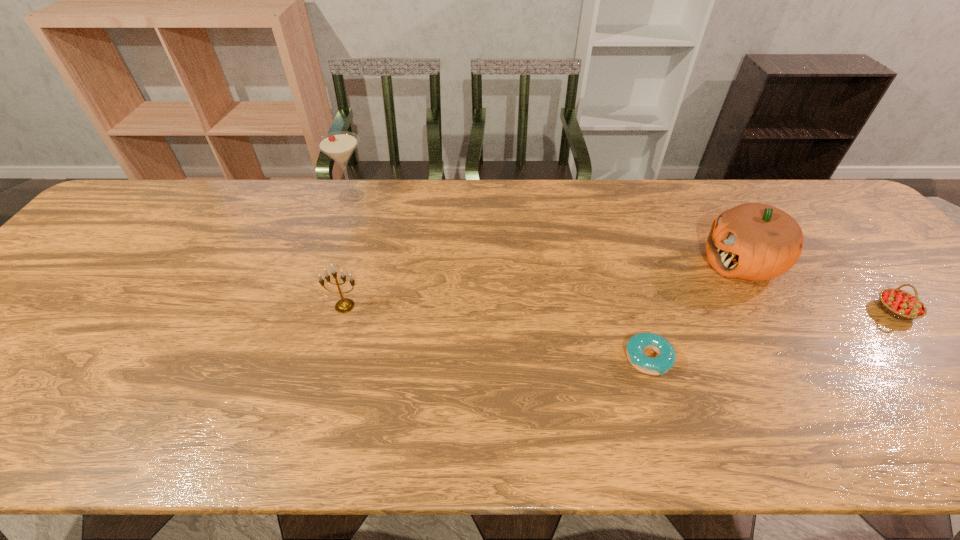
The height and width of the screenshot is (540, 960). I want to click on empty space between the shortest object and the second farthest object, so click(695, 310).

Identify the location of empty space between the martini and the shortest object. (500, 278).

Locate which object ranks fourth in proximity to the strawberry. Please provide its 2D coordinates. Your answer should be formatted as a tuple, i.e. [(x, y)], where the tuple contains the x and y coordinates of a point satisfying the conditions above.

[(340, 145)]

Identify which object is the third nearest to the pumpkin. Please provide its 2D coordinates. Your answer should be formatted as a tuple, i.e. [(x, y)], where the tuple contains the x and y coordinates of a point satisfying the conditions above.

[(344, 305)]

Image resolution: width=960 pixels, height=540 pixels. In order to click on free location that satisfies the following two spatial constraints: 1. on the front side of the farthest object; 2. on the right side of the candelabrum in this screenshot , I will do `click(314, 306)`.

Image resolution: width=960 pixels, height=540 pixels. What are the coordinates of `free location that satisfies the following two spatial constraints: 1. on the front side of the third shortest object; 2. on the right side of the martini` in the screenshot? It's located at (314, 306).

Identify the location of free location that satisfies the following two spatial constraints: 1. on the front side of the candelabrum; 2. on the left side of the rightmost object. click(344, 310).

You are a GUI agent. You are given a task and a screenshot of the screen. Output one action in this format:
    pyautogui.click(x=<x>, y=<y>)
    Task: Click on the free space that satisfies the following two spatial constraints: 1. on the back side of the fourth tallest object; 2. on the left side of the nearest object
    
    Given the screenshot: What is the action you would take?
    pyautogui.click(x=633, y=310)